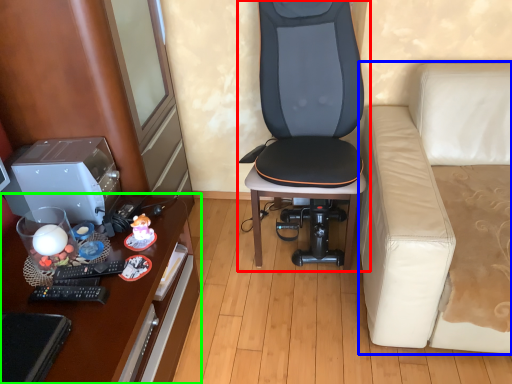
Question: Estimate the real-world distances between objects in this image. Which object is farther from chair (highlighted by a red box), studio couch (highlighted by a blue box) or desk (highlighted by a green box)?

Choices:
 (A) studio couch
 (B) desk

Answer: (B)